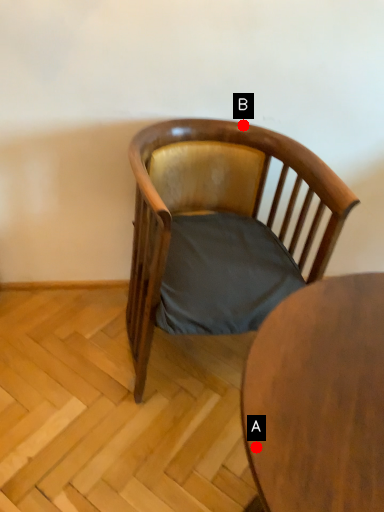
Question: Two points are circled on the image, labeled by A and B beside each circle. Which point is closer to the camera taking this photo?

Choices:
 (A) A is closer
 (B) B is closer

Answer: (A)